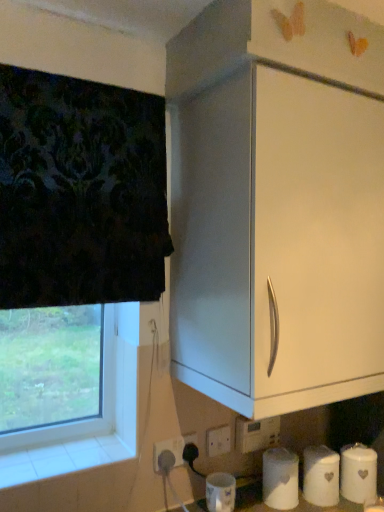
Question: Considering the positions of point (172, 449) and point (221, 454), is point (172, 449) closer or farther from the camera than point (221, 454)?

Choices:
 (A) closer
 (B) farther

Answer: (A)

Question: Based on their sizes in the image, would you say white plastic electric outlet at lower center, the 3th electric outlet when ordered from right to left, is bigger or smaller than white plastic electric outlet at lower center, the third electric outlet positioned from the left?

Choices:
 (A) big
 (B) small

Answer: (A)

Question: Which object is the closest to the white plastic electric outlet at lower center, the 2th electric outlet in the left-to-right sequence?

Choices:
 (A) white plastic electric outlet at lower center, arranged as the 1th electric outlet when viewed from the right
 (B) white matte paper towel at lower center
 (C) transparent glass window at lower left
 (D) white matte toilet paper at lower center, the 1th toilet paper viewed from the left
 (E) white matte cabinet at upper right

Answer: (A)

Question: Based on their relative distances, which object is nearer to the white matte toilet paper at lower center, placed as the third toilet paper when sorted from right to left?

Choices:
 (A) white plastic electric outlet at lower center, arranged as the 1th electric outlet when viewed from the right
 (B) white matte paper towel at lower center
 (C) white ceramic canister at lower right, acting as the 1th toilet paper starting from the right
 (D) white plastic electric outlet at lower center, the 2th electric outlet in the right-to-left sequence
 (E) white matte canister at lower right, which ranks as the 2th toilet paper in left-to-right order

Answer: (E)